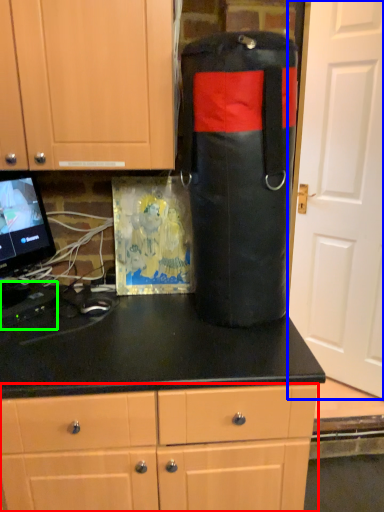
Question: Based on their relative distances, which object is nearer to cabinetry (highlighted by a red box)? Choose from door (highlighted by a blue box) and appliance (highlighted by a green box).

Choices:
 (A) door
 (B) appliance

Answer: (B)